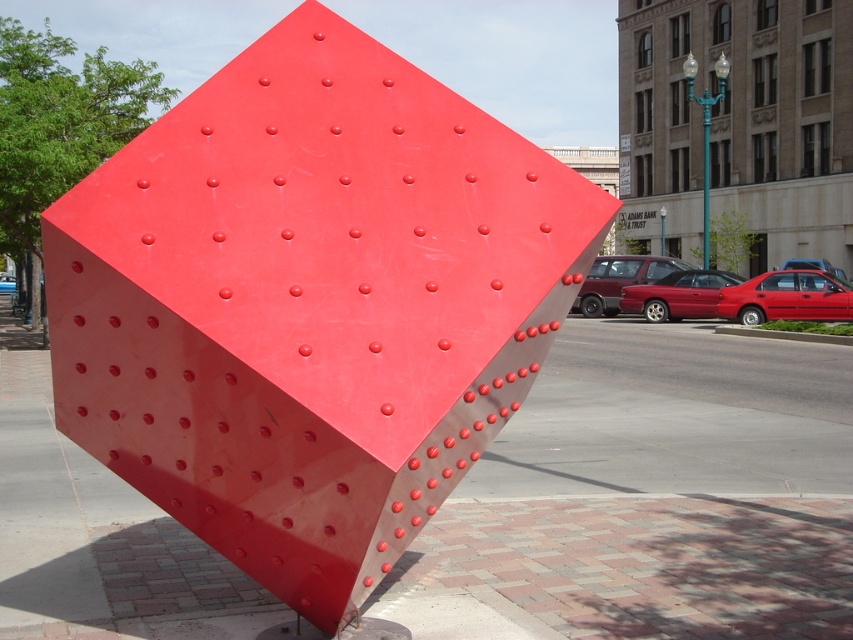
You are a delivery robot with a 2.0 meter long package. You need to move the package from the glossy red cube at center to the glossy concrete pavement at center. Can you move the package without needing to tilt or rotate it?

The distance between the glossy red cube at center and the glossy concrete pavement at center is 2.20 meters. Since the package is 2.0 meters long, it can be moved without tilting or rotating as the distance is sufficient.

You are standing in front of the large red cube sculpture and looking at the two points marked on the cube. Which point, point [129,236] or point [393,593], is nearer to you?

Point [129,236] is closer to the camera than point [393,593], so it is nearer to you.